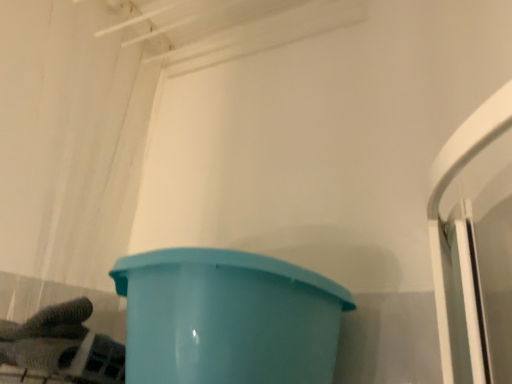
What are the coordinates of `matte plastic bucket at center` in the screenshot? It's located at (227, 318).

This screenshot has width=512, height=384. What do you see at coordinates (227, 318) in the screenshot? I see `matte plastic bucket at center` at bounding box center [227, 318].

Measure the distance between matte plastic bucket at center and camera.

They are 22.74 inches apart.

In order to face matte plastic bucket at center, should I rotate leftwards or rightwards?

A 2.030 degree turn to the left will do.

Where is `matte plastic bucket at center`? The width and height of the screenshot is (512, 384). matte plastic bucket at center is located at coordinates (227, 318).